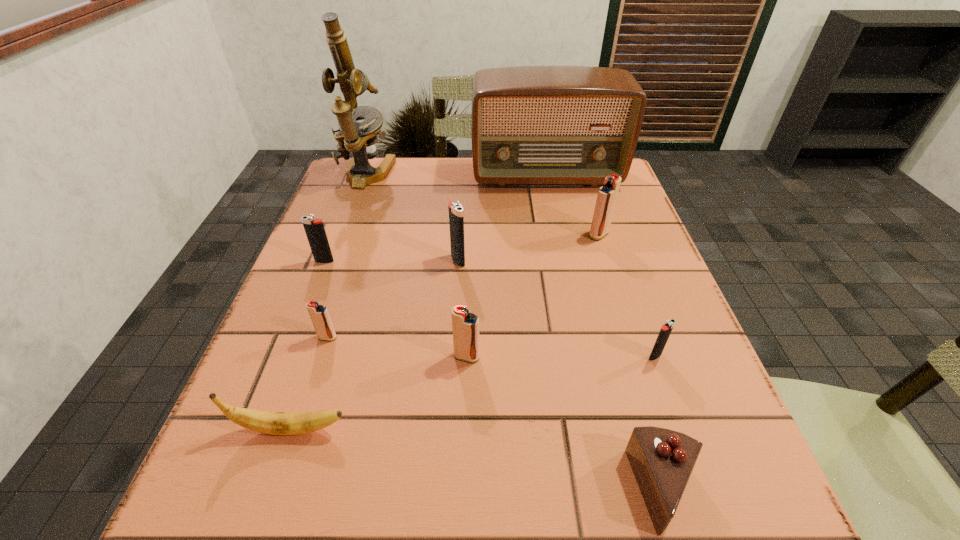
The image size is (960, 540). I want to click on vacant area that lies between the ninth shortest object and the yellow banana, so click(x=419, y=303).

The image size is (960, 540). I want to click on unoccupied position between the ninth farthest object and the leftmost black igniter, so click(x=307, y=346).

Locate which object is the third closest to the second tallest object. Please provide its 2D coordinates. Your answer should be formatted as a tuple, i.e. [(x, y)], where the tuple contains the x and y coordinates of a point satisfying the conditions above.

[(456, 216)]

Where is `object that is the seventh nearest to the radio receiver`? This screenshot has width=960, height=540. object that is the seventh nearest to the radio receiver is located at coordinates click(x=319, y=314).

Choose which igniter is the fifth nearest neighbor to the second smallest black igniter. Please provide its 2D coordinates. Your answer should be formatted as a tuple, i.e. [(x, y)], where the tuple contains the x and y coordinates of a point satisfying the conditions above.

[(666, 329)]

Locate which igniter is the second closest to the third nearest igniter. Please provide its 2D coordinates. Your answer should be formatted as a tuple, i.e. [(x, y)], where the tuple contains the x and y coordinates of a point satisfying the conditions above.

[(465, 326)]

Identify which red igniter is located as the third nearest to the nearest object. Please provide its 2D coordinates. Your answer should be formatted as a tuple, i.e. [(x, y)], where the tuple contains the x and y coordinates of a point satisfying the conditions above.

[(319, 314)]

Locate which red igniter ranks in proximity to the second farthest red igniter. Please provide its 2D coordinates. Your answer should be formatted as a tuple, i.e. [(x, y)], where the tuple contains the x and y coordinates of a point satisfying the conditions above.

[(465, 326)]

Identify which black igniter is located as the nearest to the nearest object. Please provide its 2D coordinates. Your answer should be formatted as a tuple, i.e. [(x, y)], where the tuple contains the x and y coordinates of a point satisfying the conditions above.

[(666, 329)]

Locate which black igniter ranks third in proximity to the nearest object. Please provide its 2D coordinates. Your answer should be formatted as a tuple, i.e. [(x, y)], where the tuple contains the x and y coordinates of a point satisfying the conditions above.

[(314, 228)]